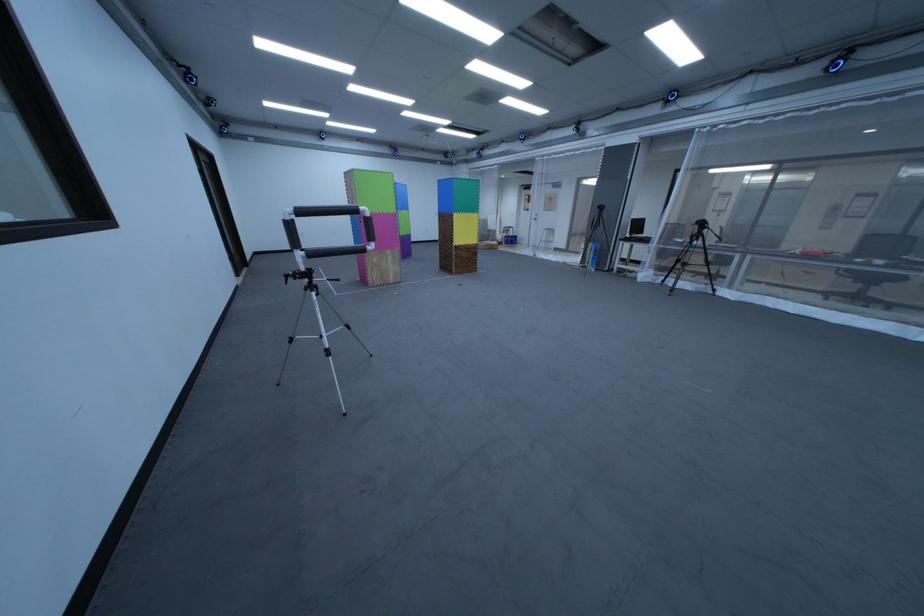
What do you see at coordinates (854, 265) in the screenshot? I see `a chair armrest` at bounding box center [854, 265].